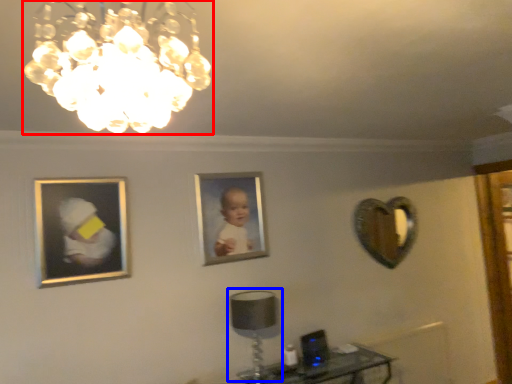
Question: Which point is closer to the camera, lamp (highlighted by a red box) or table lamp (highlighted by a blue box)?

Choices:
 (A) lamp
 (B) table lamp

Answer: (A)